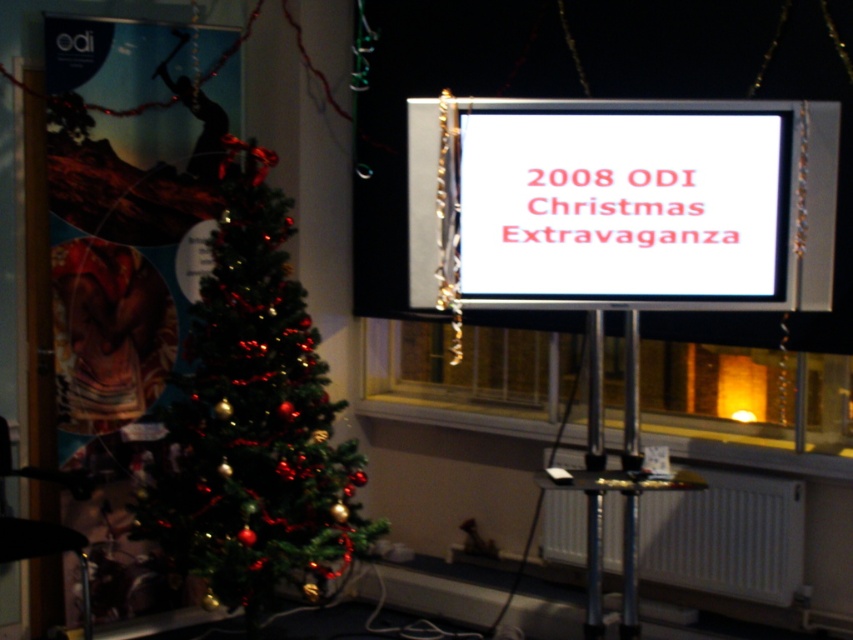
Question: Is green shiny christmas tree at left to the right of white plastic radiator at lower right from the viewer's perspective?

Choices:
 (A) yes
 (B) no

Answer: (B)

Question: Which of the following is the farthest from the observer?

Choices:
 (A) 717,180
 (B) 763,538
 (C) 219,381

Answer: (B)

Question: Does green shiny christmas tree at left appear on the right side of white plastic radiator at lower right?

Choices:
 (A) no
 (B) yes

Answer: (A)

Question: Which of the following is the closest to the observer?

Choices:
 (A) white plastic radiator at lower right
 (B) white glossy screen at center
 (C) green shiny christmas tree at left

Answer: (B)

Question: Is the position of white glossy screen at center more distant than that of white plastic radiator at lower right?

Choices:
 (A) no
 (B) yes

Answer: (A)

Question: Considering the real-world distances, which object is closest to the green shiny christmas tree at left?

Choices:
 (A) white plastic radiator at lower right
 (B) white glossy screen at center

Answer: (A)